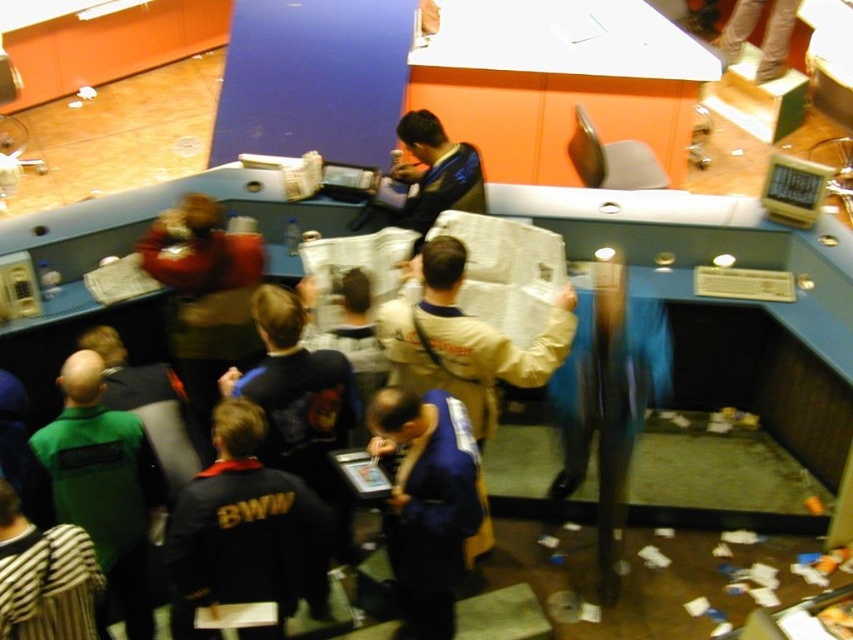
Between green fleece jacket at left and blue fabric shirt at center, which one has less height?

blue fabric shirt at center

Locate an element on the screen. This screenshot has width=853, height=640. green fleece jacket at left is located at coordinates (102, 486).

Where is `green fleece jacket at left`? Image resolution: width=853 pixels, height=640 pixels. green fleece jacket at left is located at coordinates (102, 486).

Is the position of blue fabric shirt at center more distant than that of khaki fabric jacket at center?

No, it is not.

Which is in front, point (453, 593) or point (537, 355)?

Positioned in front is point (537, 355).

Locate an element on the screen. The width and height of the screenshot is (853, 640). blue fabric shirt at center is located at coordinates (426, 502).

Is point (94, 470) positioned after point (448, 385)?

No, (94, 470) is closer to viewer.

Between green fleece jacket at left and khaki fabric jacket at center, which one is positioned higher?

khaki fabric jacket at center is higher up.

What do you see at coordinates (102, 486) in the screenshot? I see `green fleece jacket at left` at bounding box center [102, 486].

At what (x,y) coordinates should I click in order to perform the action: click on green fleece jacket at left. Please return your answer as a coordinate pair (x, y). Looking at the image, I should click on (102, 486).